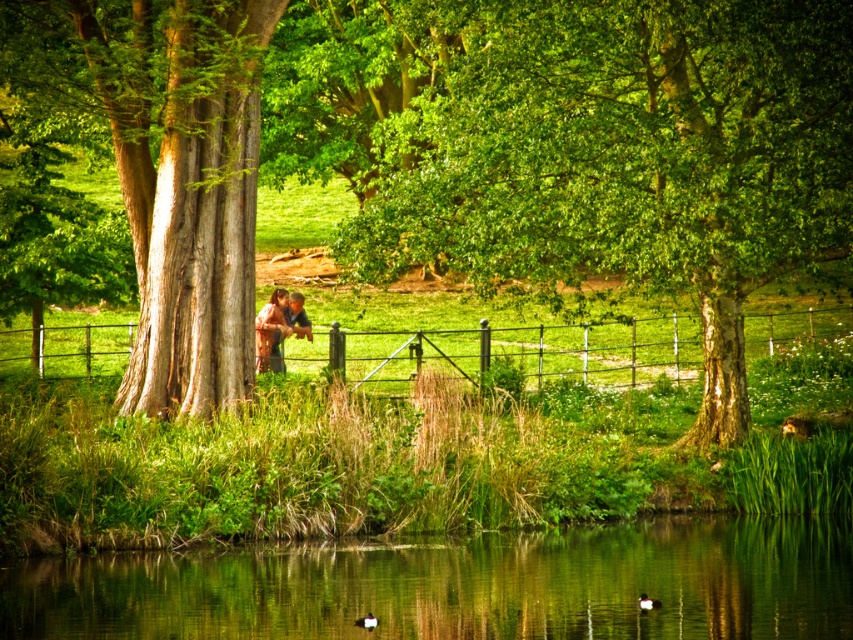
You are standing at the edge of the pond and see the transparent water at lower center and the smooth brown tree trunk at left. Which object is closer to your right side?

The transparent water at lower center is positioned on the right side of smooth brown tree trunk at left, so the transparent water at lower center is closer to your right side.

In the scene shown: You are a photographer trying to capture a landscape photo of the green leafy tree at center and the rustic wooden fence at center. Which object will appear larger in the photo?

The green leafy tree at center will appear larger in the photo because it is much taller than the rustic wooden fence at center.